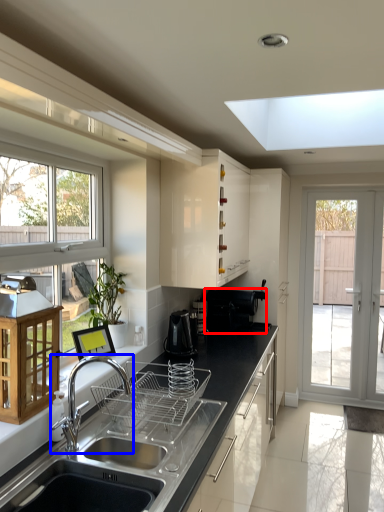
Question: Which point is closer to the camera, appliance (highlighted by a red box) or tap (highlighted by a blue box)?

Choices:
 (A) appliance
 (B) tap

Answer: (B)